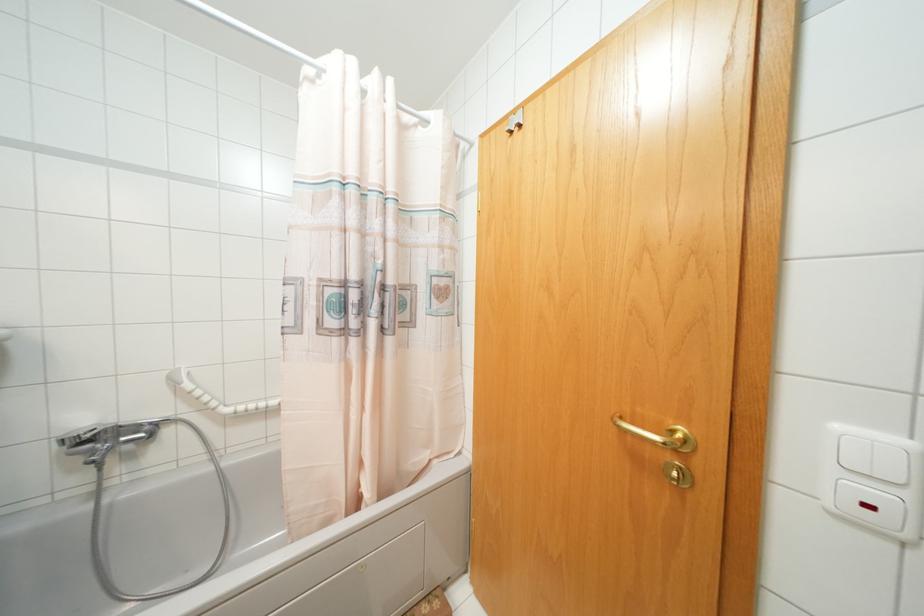
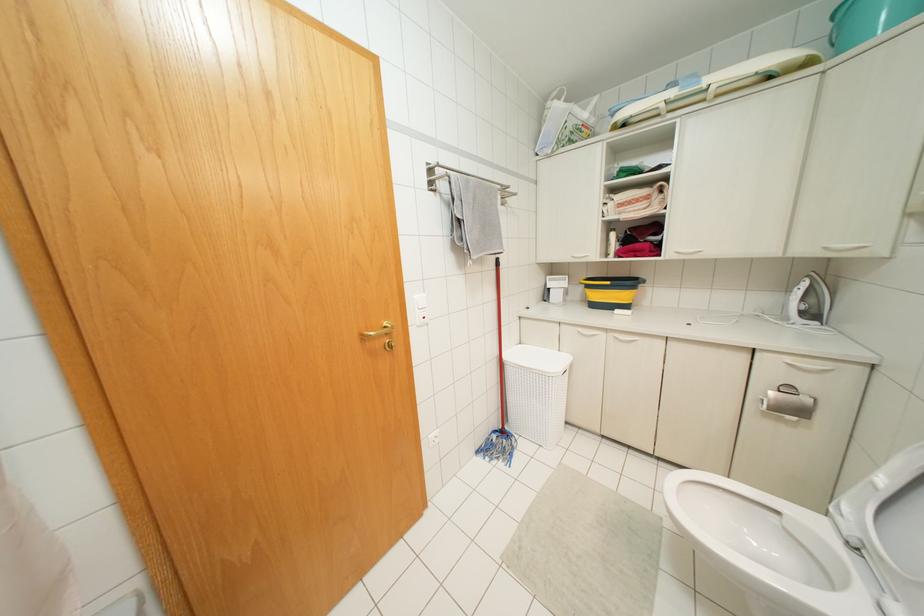
Question: The first image is from the beginning of the video and the second image is from the end. How did the camera likely rotate when shooting the video?

Choices:
 (A) Left
 (B) Right
 (C) Up
 (D) Down

Answer: (B)